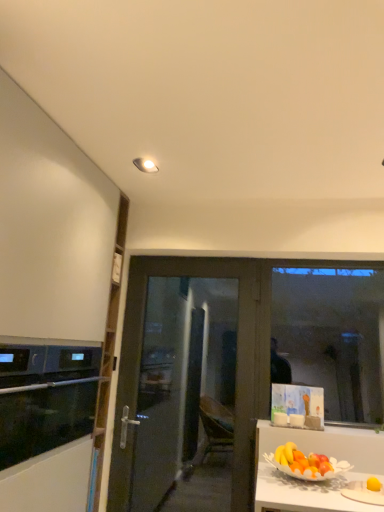
Question: Is white matte cabinet at left touching black glass oven at left?

Choices:
 (A) yes
 (B) no

Answer: (B)

Question: Is white matte cabinet at left turned away from black glass oven at left?

Choices:
 (A) no
 (B) yes

Answer: (B)

Question: Considering the relative sizes of white matte cabinet at left and black glass oven at left in the image provided, is white matte cabinet at left taller than black glass oven at left?

Choices:
 (A) yes
 (B) no

Answer: (A)

Question: Is white matte cabinet at left at the left side of black glass oven at left?

Choices:
 (A) no
 (B) yes

Answer: (B)

Question: From the image's perspective, is white matte cabinet at left under black glass oven at left?

Choices:
 (A) yes
 (B) no

Answer: (B)

Question: Looking at their shapes, would you say transparent glass window at right is wider or thinner than transparent glass door at center?

Choices:
 (A) thin
 (B) wide

Answer: (A)

Question: Visually, is transparent glass window at right positioned to the left or to the right of transparent glass door at center?

Choices:
 (A) right
 (B) left

Answer: (A)

Question: Is transparent glass window at right bigger or smaller than transparent glass door at center?

Choices:
 (A) big
 (B) small

Answer: (B)

Question: From the image's perspective, is transparent glass window at right positioned above or below transparent glass door at center?

Choices:
 (A) above
 (B) below

Answer: (A)

Question: Considering the positions of transparent glass window at right and black glass oven at left in the image, is transparent glass window at right bigger or smaller than black glass oven at left?

Choices:
 (A) small
 (B) big

Answer: (A)

Question: From a real-world perspective, is transparent glass window at right physically located above or below black glass oven at left?

Choices:
 (A) above
 (B) below

Answer: (A)

Question: From the image's perspective, relative to black glass oven at left, is transparent glass window at right above or below?

Choices:
 (A) above
 (B) below

Answer: (A)

Question: In the image, is transparent glass window at right positioned in front of or behind black glass oven at left?

Choices:
 (A) behind
 (B) front

Answer: (A)

Question: From the image's perspective, is transparent glass door at center positioned above or below white matte cabinet at left?

Choices:
 (A) above
 (B) below

Answer: (B)

Question: Considering the positions of transparent glass door at center and white matte cabinet at left in the image, is transparent glass door at center bigger or smaller than white matte cabinet at left?

Choices:
 (A) small
 (B) big

Answer: (A)